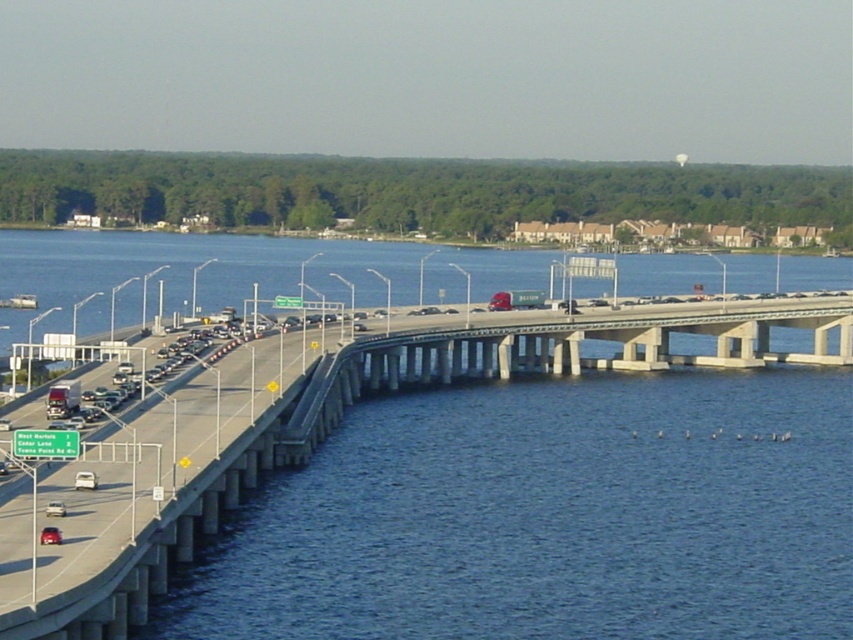
You are a drone operator who needs to fly a drone from the concrete bridge at center to the silver metallic sedan at center. According to the image, what is the minimum horizontal distance you need to cover?

The minimum horizontal distance between the concrete bridge at center and the silver metallic sedan at center is 78.56 meters, so you need to cover at least 78.56 meters.

You are a pedestrian trying to cross the highway bridge. You see the concrete bridge at center and the silver metallic sedan at center. Which object is higher from the ground?

The concrete bridge at center is above the silver metallic sedan at center, so the concrete bridge at center is higher from the ground.